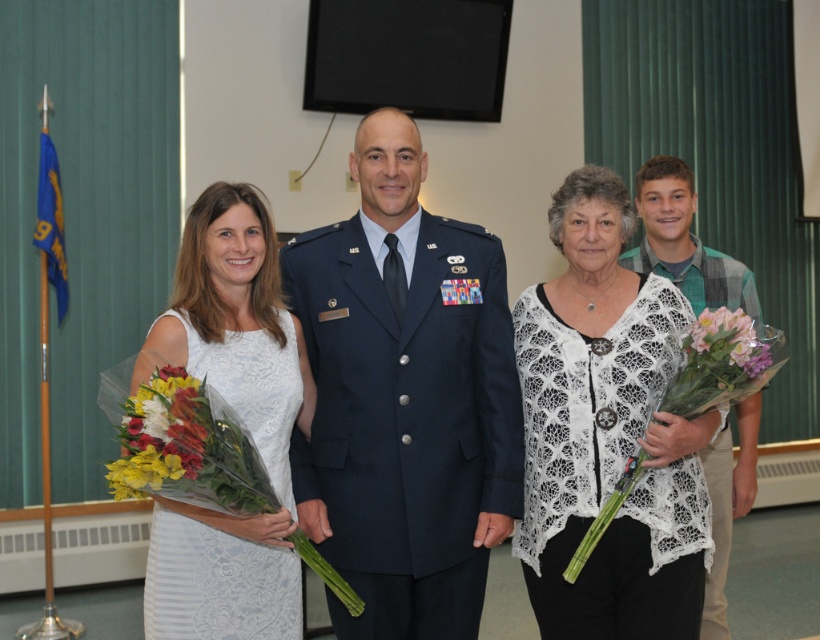
Question: Can you confirm if navy blue fabric uniform at center is positioned to the left of glossy floral bouquet at left?

Choices:
 (A) yes
 (B) no

Answer: (B)

Question: Which point appears closest to the camera in this image?

Choices:
 (A) (540, 291)
 (B) (713, 596)
 (C) (171, 490)
 (D) (386, 365)

Answer: (C)

Question: Can you confirm if navy blue fabric uniform at center is positioned below white lace shawl at right?

Choices:
 (A) no
 (B) yes

Answer: (A)

Question: Can you confirm if white lace shawl at right is wider than glossy floral bouquet at left?

Choices:
 (A) no
 (B) yes

Answer: (B)

Question: Estimate the real-world distances between objects in this image. Which object is closer to the white lace dress at left?

Choices:
 (A) white lace shawl at right
 (B) navy blue fabric uniform at center
 (C) glossy floral bouquet at left
 (D) pink floral bouquet at center

Answer: (B)

Question: Considering the real-world distances, which object is farthest from the white lace cardigan at center?

Choices:
 (A) white lace shawl at right
 (B) pink floral bouquet at center

Answer: (A)